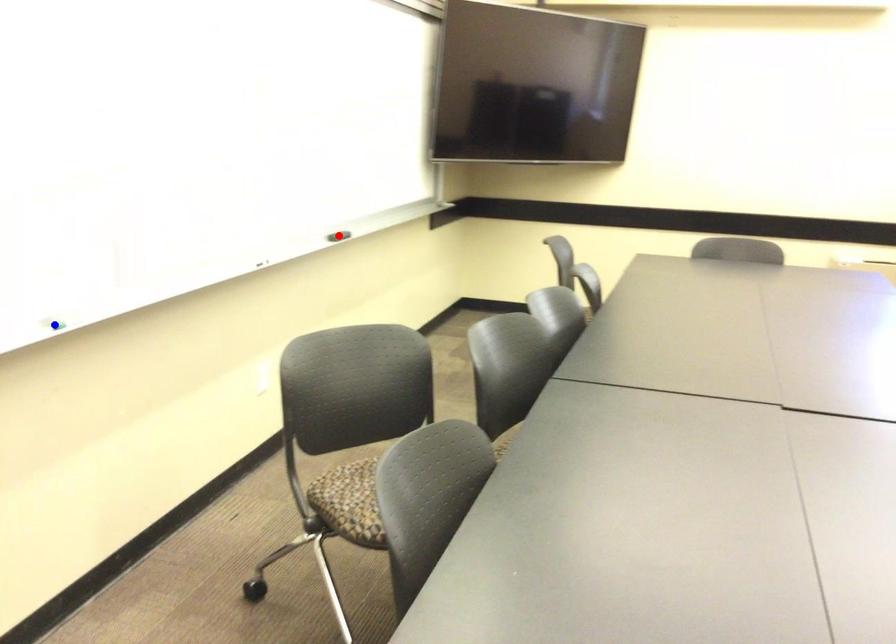
Question: Two points are marked on the image. Which point is closer to the camera?

Choices:
 (A) Blue point is closer.
 (B) Red point is closer.

Answer: (A)